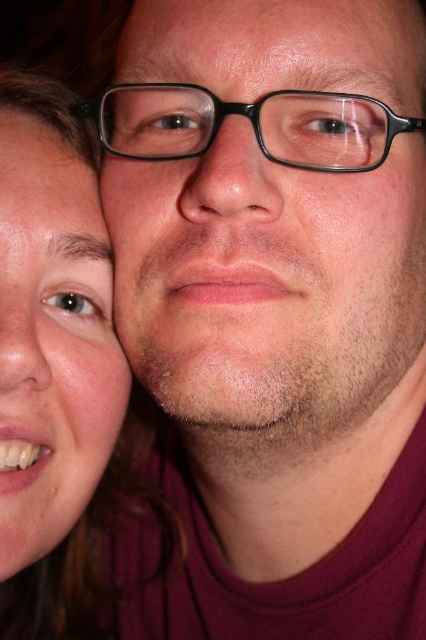
Question: Can you confirm if matte skin face at lower left is bigger than smooth skin at upper center?

Choices:
 (A) yes
 (B) no

Answer: (A)

Question: Which point is closer to the camera?

Choices:
 (A) [x=100, y=438]
 (B) [x=273, y=45]

Answer: (B)

Question: Which of these objects is positioned closest to the matte skin face at lower left?

Choices:
 (A) smooth skin at upper center
 (B) matte black glasses at center

Answer: (B)

Question: In this image, where is matte skin face at lower left located relative to smooth skin at upper center?

Choices:
 (A) right
 (B) left

Answer: (B)

Question: Is matte black glasses at center smaller than smooth skin at upper center?

Choices:
 (A) yes
 (B) no

Answer: (B)

Question: Which point is closer to the camera?

Choices:
 (A) (123, 19)
 (B) (298, 177)

Answer: (B)